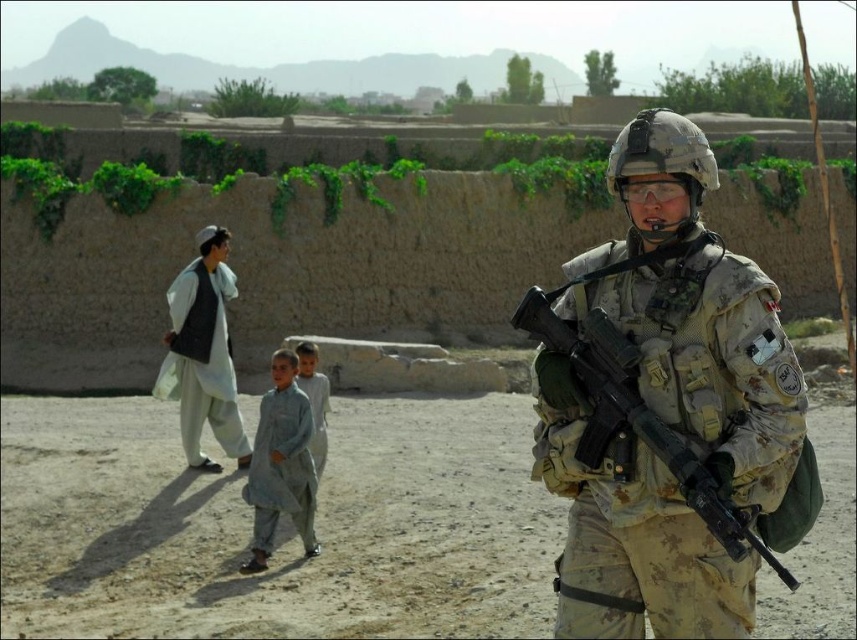
Question: Which object is the closest to the light gray fabric at left?

Choices:
 (A) camouflage fabric uniform at center
 (B) light gray fabric child at center

Answer: (B)

Question: Which point is farther to the camera?

Choices:
 (A) dirt field at center
 (B) light gray fabric at center

Answer: (B)

Question: Does light gray fabric at left come in front of light gray fabric at center?

Choices:
 (A) no
 (B) yes

Answer: (A)

Question: Does camouflage fabric uniform at center have a larger size compared to light gray fabric child at center?

Choices:
 (A) yes
 (B) no

Answer: (A)

Question: Where is dirt field at center located in relation to camouflage fabric uniform at center in the image?

Choices:
 (A) below
 (B) above

Answer: (A)

Question: Which point appears closest to the camera in this image?

Choices:
 (A) (339, 522)
 (B) (655, 289)

Answer: (B)